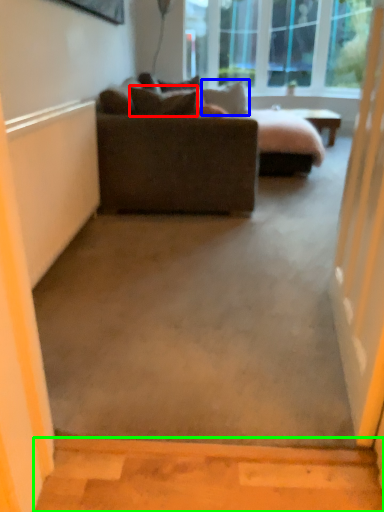
Question: Which object is positioned farthest from pillow (highlighted by a red box)? Select from pillow (highlighted by a blue box) and concrete (highlighted by a green box).

Choices:
 (A) pillow
 (B) concrete

Answer: (B)